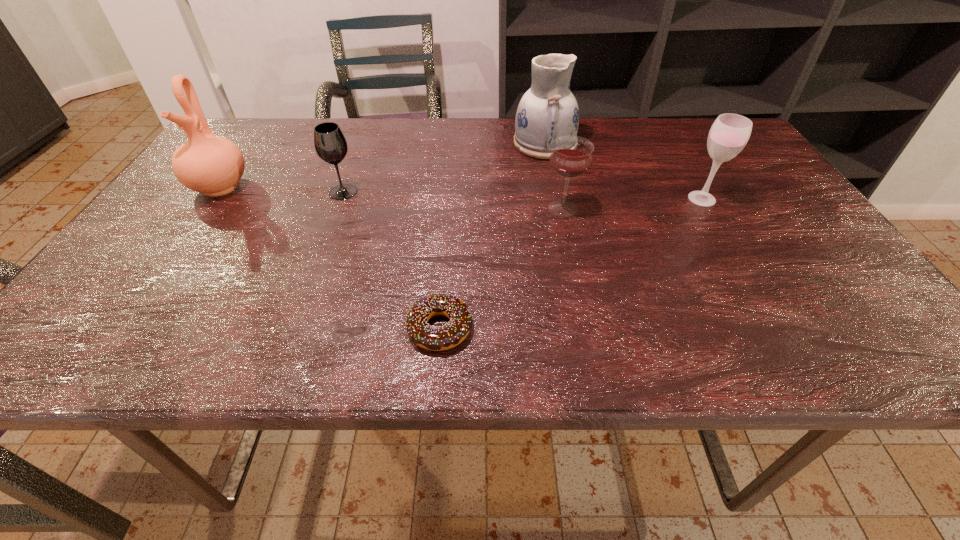
I want to click on free space in the image that satisfies the following two spatial constraints: 1. on the back side of the fourth object from right to left; 2. on the right side of the second wineglass from left to right, so click(x=449, y=208).